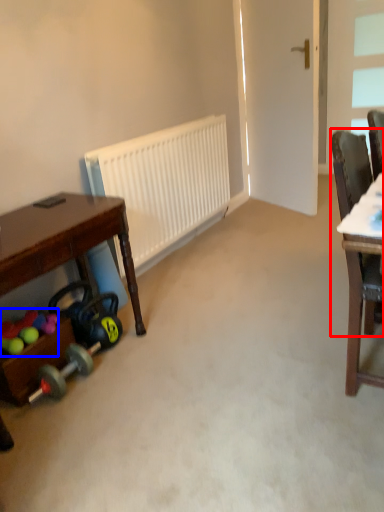
Question: Which object is closer to the camera taking this photo, chair (highlighted by a red box) or toy (highlighted by a blue box)?

Choices:
 (A) chair
 (B) toy

Answer: (A)